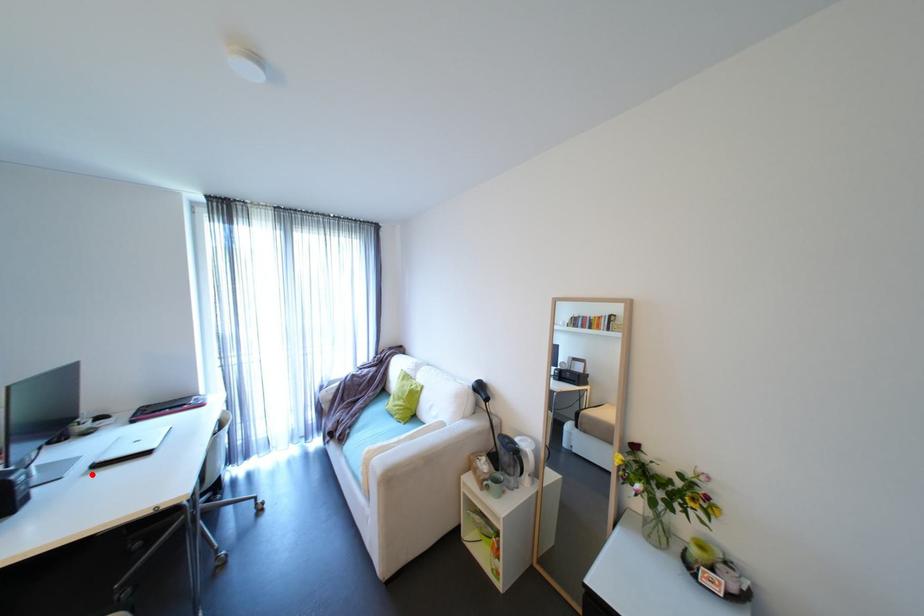
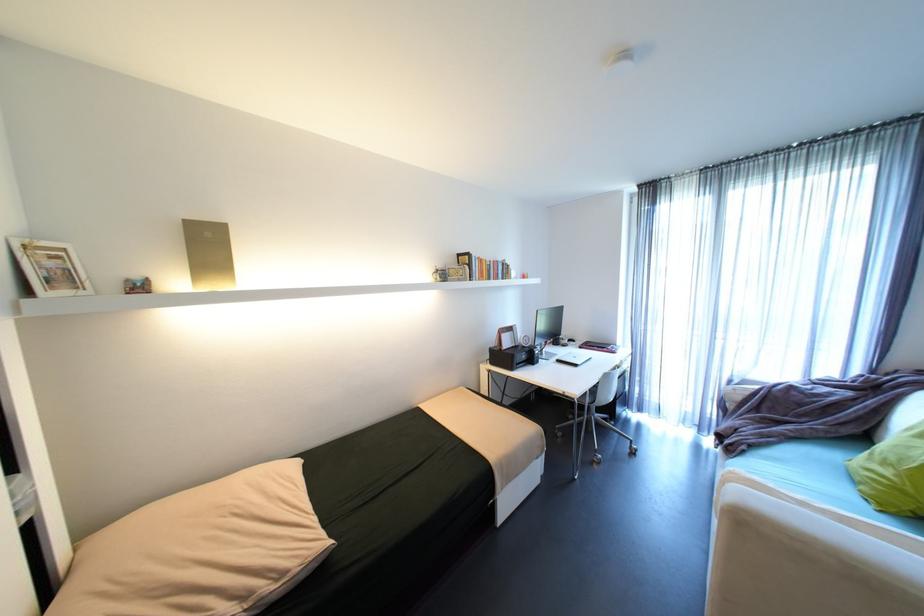
Question: I am providing you with two images of the same scene from different viewpoints. A red point is marked on the first image. Can you still see the location of the red point in image 2?

Choices:
 (A) Yes
 (B) No

Answer: (A)